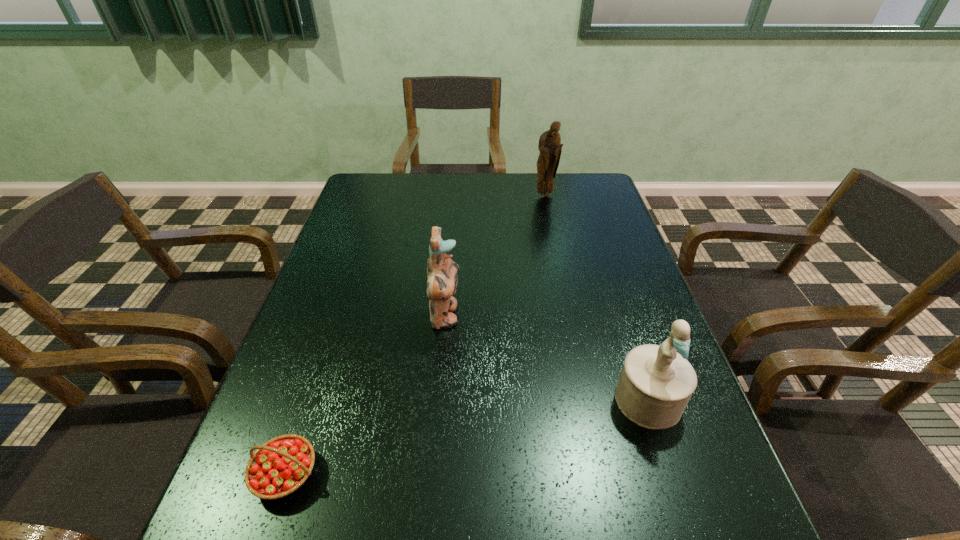
Where is `vacant area located 0.170m at the beak of the nearest figurine`? The width and height of the screenshot is (960, 540). vacant area located 0.170m at the beak of the nearest figurine is located at coordinates (689, 524).

Image resolution: width=960 pixels, height=540 pixels. Identify the location of vacant space located 0.260m on the back of the leftmost object. (331, 339).

You are a GUI agent. You are given a task and a screenshot of the screen. Output one action in this format:
    pyautogui.click(x=<x>, y=<y>)
    Task: Click on the object located at the far edge
    
    Given the screenshot: What is the action you would take?
    pyautogui.click(x=550, y=147)

Where is `object at the left edge`? The height and width of the screenshot is (540, 960). object at the left edge is located at coordinates (279, 467).

What are the coordinates of `object positioned at the right edge` in the screenshot? It's located at (656, 383).

The height and width of the screenshot is (540, 960). Find the location of `free spot at the far edge of the desktop`. free spot at the far edge of the desktop is located at coordinates (456, 200).

Identify the location of vacant space at the near edge of the desktop. (399, 534).

This screenshot has width=960, height=540. I want to click on vacant region at the left edge of the desktop, so click(363, 208).

In order to click on free space at the right edge of the desktop in this screenshot , I will do `click(696, 448)`.

You are a GUI agent. You are given a task and a screenshot of the screen. Output one action in this format:
    pyautogui.click(x=<x>, y=<y>)
    Task: Click on the free space at the far right corner of the desktop
    This screenshot has height=540, width=960.
    Given the screenshot: What is the action you would take?
    pyautogui.click(x=578, y=196)